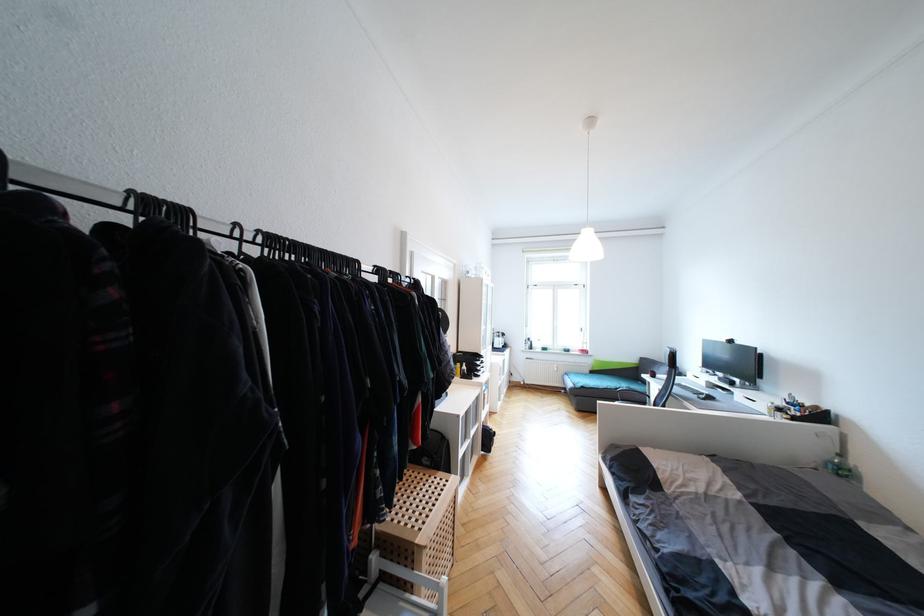
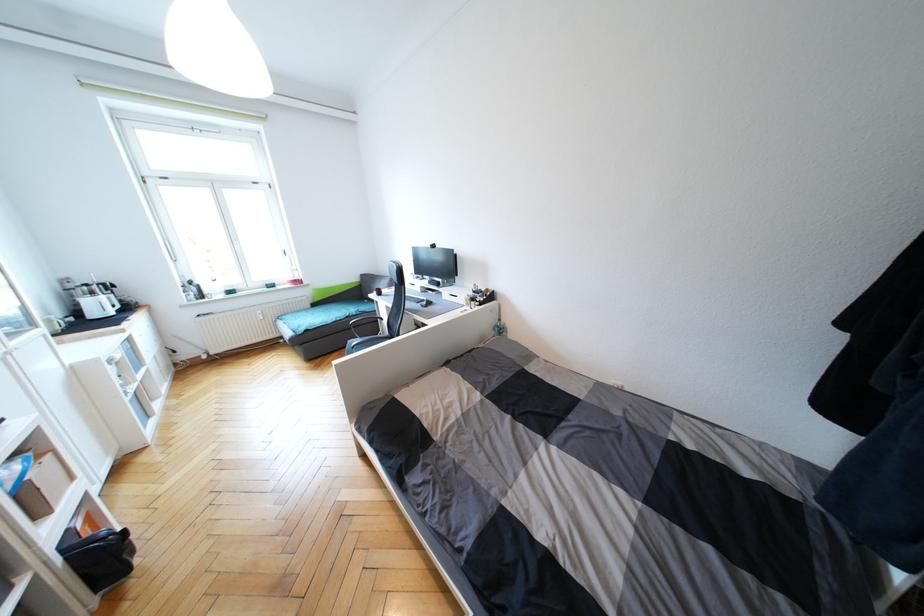
Locate, in the second image, the point that corresponds to (507,347) in the first image.

(130, 309)